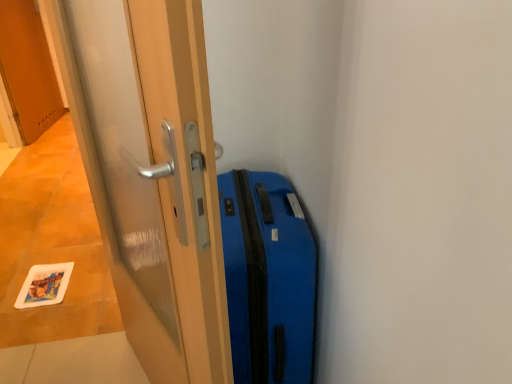
This screenshot has height=384, width=512. Describe the element at coordinates (154, 177) in the screenshot. I see `transparent glass door at center, positioned as the second door in top-to-bottom order` at that location.

Where is `wooden door at upper left, marked as the 2th door in a front-to-back arrangement`? The image size is (512, 384). wooden door at upper left, marked as the 2th door in a front-to-back arrangement is located at coordinates (28, 69).

From the image's perspective, would you say wooden door at upper left, the second door in the right-to-left sequence, is positioned over blue matte suitcase at right?

Indeed, from the image's perspective, wooden door at upper left, the second door in the right-to-left sequence, is shown above blue matte suitcase at right.

Is point (40, 90) less distant than point (254, 292)?

No, (40, 90) is further to viewer.

Which is more to the right, wooden door at upper left, the first door viewed from the back, or blue matte suitcase at right?

From the viewer's perspective, blue matte suitcase at right appears more on the right side.

Is wooden door at upper left, the first door viewed from the back, positioned beyond the bounds of transparent glass door at center, which is the 1th door in bottom-to-top order?

Yes, wooden door at upper left, the first door viewed from the back, is outside of transparent glass door at center, which is the 1th door in bottom-to-top order.

Which is farther, (6,46) or (67,41)?

The point (6,46) is behind.

From a real-world perspective, is wooden door at upper left, acting as the 1th door starting from the top, physically below transparent glass door at center, arranged as the 1th door when viewed from the front?

Yes, from a real-world perspective, wooden door at upper left, acting as the 1th door starting from the top, is beneath transparent glass door at center, arranged as the 1th door when viewed from the front.

From their relative heights in the image, would you say wooden door at upper left, marked as the 2th door in a front-to-back arrangement, is taller or shorter than transparent glass door at center, which ranks as the 2th door in back-to-front order?

Considering their sizes, wooden door at upper left, marked as the 2th door in a front-to-back arrangement, has less height than transparent glass door at center, which ranks as the 2th door in back-to-front order.

Could you tell me if transparent glass door at center, arranged as the 1th door when viewed from the front, is facing wooden door at upper left, the second door in the right-to-left sequence?

No, transparent glass door at center, arranged as the 1th door when viewed from the front, is not oriented towards wooden door at upper left, the second door in the right-to-left sequence.

Is transparent glass door at center, which is the first door in right-to-left order, not inside wooden door at upper left, which is the first door in left-to-right order?

transparent glass door at center, which is the first door in right-to-left order, is positioned outside wooden door at upper left, which is the first door in left-to-right order.

Which is closer to the camera, (126, 200) or (5, 71)?

Point (126, 200).

Based on the photo, are transparent glass door at center, marked as the second door in a left-to-right arrangement, and wooden door at upper left, which is the first door in left-to-right order, located far from each other?

Absolutely, transparent glass door at center, marked as the second door in a left-to-right arrangement, is distant from wooden door at upper left, which is the first door in left-to-right order.

What are the coordinates of `suitcase lying on the right of transparent glass door at center, which is the 1th door in bottom-to-top order` in the screenshot? It's located at (268, 278).

Is blue matte suitcase at right closer to the viewer compared to transparent glass door at center, which is the 1th door in bottom-to-top order?

That is False.

Does blue matte suitcase at right have a greater height compared to transparent glass door at center, arranged as the 1th door when viewed from the front?

No.

Considering the relative positions of blue matte suitcase at right and transparent glass door at center, positioned as the second door in top-to-bottom order, in the image provided, is blue matte suitcase at right to the left of transparent glass door at center, positioned as the second door in top-to-bottom order, from the viewer's perspective?

No, blue matte suitcase at right is not to the left of transparent glass door at center, positioned as the second door in top-to-bottom order.

Considering the sizes of blue matte suitcase at right and wooden door at upper left, acting as the 1th door starting from the top, in the image, is blue matte suitcase at right bigger or smaller than wooden door at upper left, acting as the 1th door starting from the top,?

blue matte suitcase at right is bigger than wooden door at upper left, acting as the 1th door starting from the top.

Which object is positioned more to the right, blue matte suitcase at right or wooden door at upper left, the second door ordered from the bottom?

blue matte suitcase at right is more to the right.

Which is behind, blue matte suitcase at right or wooden door at upper left, the second door in the right-to-left sequence?

wooden door at upper left, the second door in the right-to-left sequence, is further away from the camera.

Measure the distance between blue matte suitcase at right and wooden door at upper left, the first door viewed from the back.

blue matte suitcase at right and wooden door at upper left, the first door viewed from the back, are 9.95 feet apart.

From a real-world perspective, is transparent glass door at center, which is the 1th door in bottom-to-top order, positioned above or below blue matte suitcase at right?

transparent glass door at center, which is the 1th door in bottom-to-top order, is situated higher than blue matte suitcase at right in the real world.

In the scene shown: Considering the relative positions of transparent glass door at center, which is the first door in right-to-left order, and blue matte suitcase at right in the image provided, is transparent glass door at center, which is the first door in right-to-left order, in front of blue matte suitcase at right?

Yes, transparent glass door at center, which is the first door in right-to-left order, is in front of blue matte suitcase at right.

Is transparent glass door at center, positioned as the second door in top-to-bottom order, thinner than blue matte suitcase at right?

Yes.

You are a GUI agent. You are given a task and a screenshot of the screen. Output one action in this format:
    pyautogui.click(x=<x>, y=<y>)
    Task: Click on the door in front of the blue matte suitcase at right
    
    Given the screenshot: What is the action you would take?
    pyautogui.click(x=154, y=177)

You are a GUI agent. You are given a task and a screenshot of the screen. Output one action in this format:
    pyautogui.click(x=<x>, y=<y>)
    Task: Click on the suitcase in front of the wooden door at upper left, marked as the 2th door in a front-to-back arrangement
    This screenshot has height=384, width=512.
    Given the screenshot: What is the action you would take?
    pyautogui.click(x=268, y=278)

At what (x,y) coordinates should I click in order to perform the action: click on door on the right of wooden door at upper left, acting as the 1th door starting from the top. Please return your answer as a coordinate pair (x, y). The height and width of the screenshot is (384, 512). Looking at the image, I should click on coord(154,177).

Looking at the image, which one is located further to blue matte suitcase at right, transparent glass door at center, which is the 1th door in bottom-to-top order, or wooden door at upper left, the first door viewed from the back?

wooden door at upper left, the first door viewed from the back, lies further to blue matte suitcase at right than the other object.

Estimate the real-world distances between objects in this image. Which object is closer to wooden door at upper left, the second door in the right-to-left sequence, blue matte suitcase at right or transparent glass door at center, which ranks as the 2th door in back-to-front order?

transparent glass door at center, which ranks as the 2th door in back-to-front order.

Which object lies further to the anchor point transparent glass door at center, positioned as the second door in top-to-bottom order, blue matte suitcase at right or wooden door at upper left, marked as the 2th door in a front-to-back arrangement?

Among the two, wooden door at upper left, marked as the 2th door in a front-to-back arrangement, is located further to transparent glass door at center, positioned as the second door in top-to-bottom order.

Estimate the real-world distances between objects in this image. Which object is closer to wooden door at upper left, the second door ordered from the bottom, transparent glass door at center, positioned as the second door in top-to-bottom order, or blue matte suitcase at right?

Based on the image, transparent glass door at center, positioned as the second door in top-to-bottom order, appears to be nearer to wooden door at upper left, the second door ordered from the bottom.

From the image, which object appears to be farther from blue matte suitcase at right, wooden door at upper left, acting as the 1th door starting from the top, or transparent glass door at center, positioned as the second door in top-to-bottom order?

Based on the image, wooden door at upper left, acting as the 1th door starting from the top, appears to be further to blue matte suitcase at right.

From the image, which object appears to be nearer to transparent glass door at center, which is the first door in right-to-left order, wooden door at upper left, the first door viewed from the back, or blue matte suitcase at right?

Based on the image, blue matte suitcase at right appears to be nearer to transparent glass door at center, which is the first door in right-to-left order.

This screenshot has height=384, width=512. I want to click on suitcase between transparent glass door at center, which ranks as the 2th door in back-to-front order, and wooden door at upper left, which is the first door in left-to-right order, in the front-back direction, so click(268, 278).